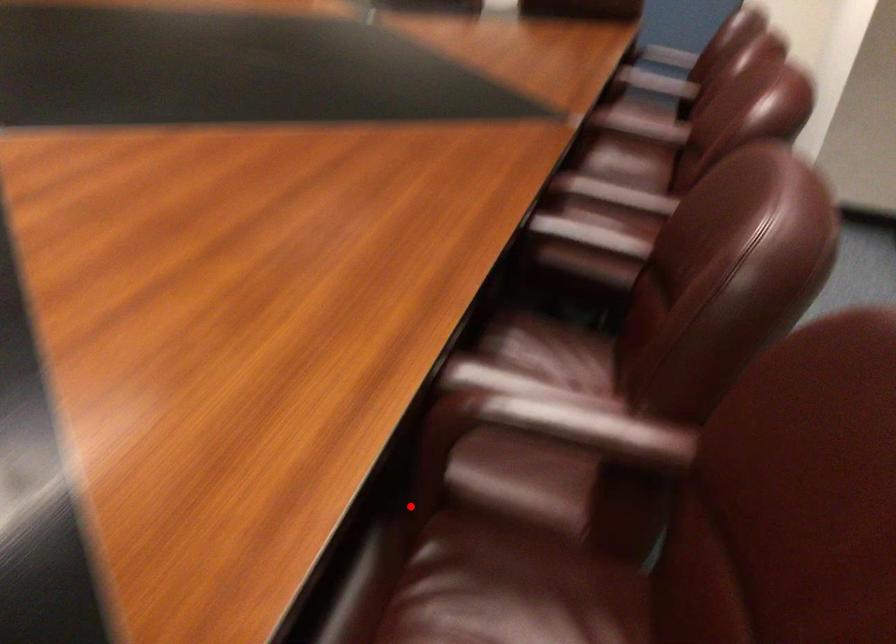
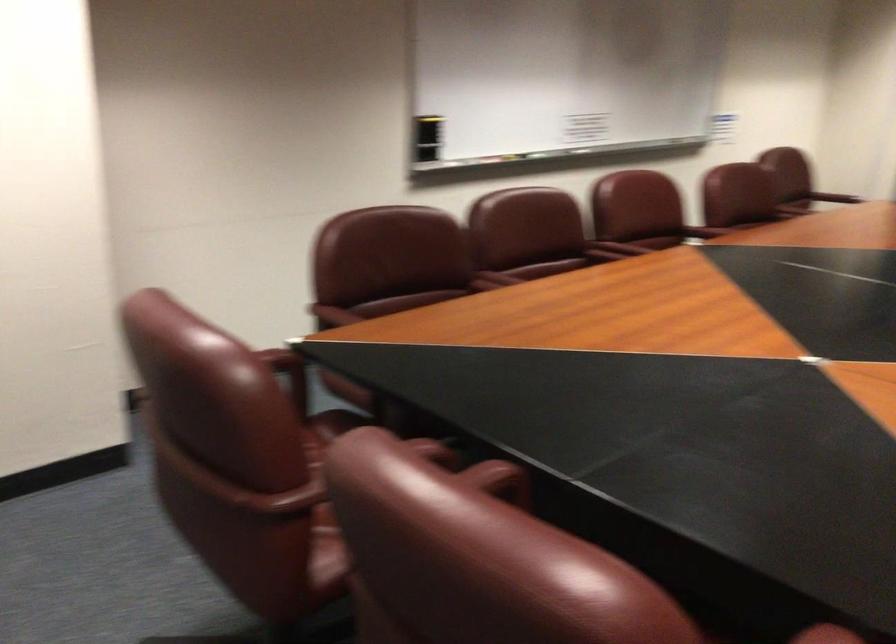
In the second image, find the point that corresponds to the highlighted location in the first image.

(834, 198)